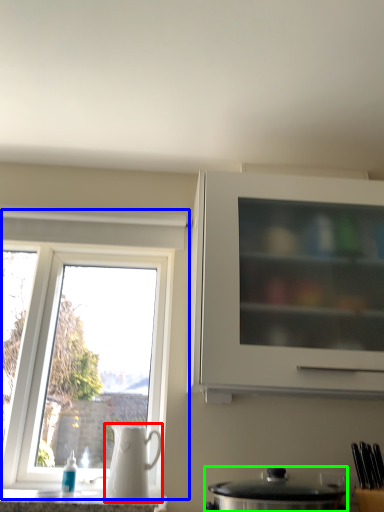
Question: Which object is the closest to the jug (highlighted by a red box)? Choose among these: window (highlighted by a blue box) or kitchen appliance (highlighted by a green box).

Choices:
 (A) window
 (B) kitchen appliance

Answer: (B)